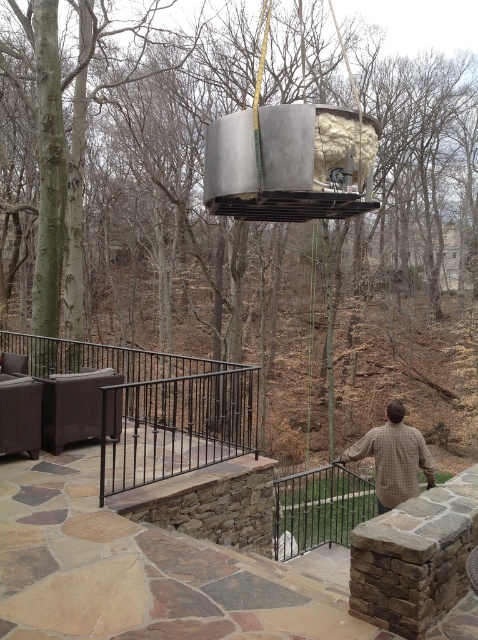
Looking at this image, can you confirm if black wrought iron railing at lower center is positioned to the left of brown plaid shirt at upper center?

Yes, black wrought iron railing at lower center is to the left of brown plaid shirt at upper center.

Is black wrought iron railing at lower center below brown plaid shirt at upper center?

Yes, black wrought iron railing at lower center is below brown plaid shirt at upper center.

Locate an element on the screen. This screenshot has height=640, width=478. black wrought iron railing at lower center is located at coordinates (175, 426).

Which is more to the left, black wrought iron railing at lower center or black metal railing at lower center?

black wrought iron railing at lower center

You are a GUI agent. You are given a task and a screenshot of the screen. Output one action in this format:
    pyautogui.click(x=<x>, y=<y>)
    Task: Click on the black wrought iron railing at lower center
    The height and width of the screenshot is (640, 478).
    Given the screenshot: What is the action you would take?
    pyautogui.click(x=175, y=426)

Where is `black wrought iron railing at lower center`? The width and height of the screenshot is (478, 640). black wrought iron railing at lower center is located at coordinates (175, 426).

Where is `black wrought iron railing at lower center`? The height and width of the screenshot is (640, 478). black wrought iron railing at lower center is located at coordinates (175, 426).

Is black wrought iron railing at lower center to the right of brown wicker sofa at lower left from the viewer's perspective?

Correct, you'll find black wrought iron railing at lower center to the right of brown wicker sofa at lower left.

Can you confirm if black wrought iron railing at lower center is positioned to the left of brown wicker sofa at lower left?

In fact, black wrought iron railing at lower center is to the right of brown wicker sofa at lower left.

This screenshot has height=640, width=478. What do you see at coordinates (175, 426) in the screenshot?
I see `black wrought iron railing at lower center` at bounding box center [175, 426].

Image resolution: width=478 pixels, height=640 pixels. Identify the location of black wrought iron railing at lower center. (175, 426).